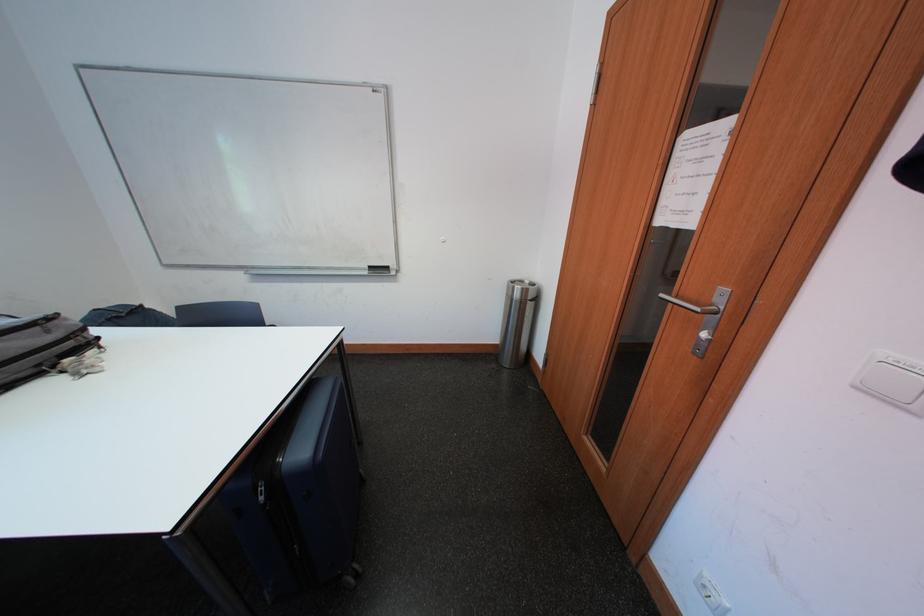
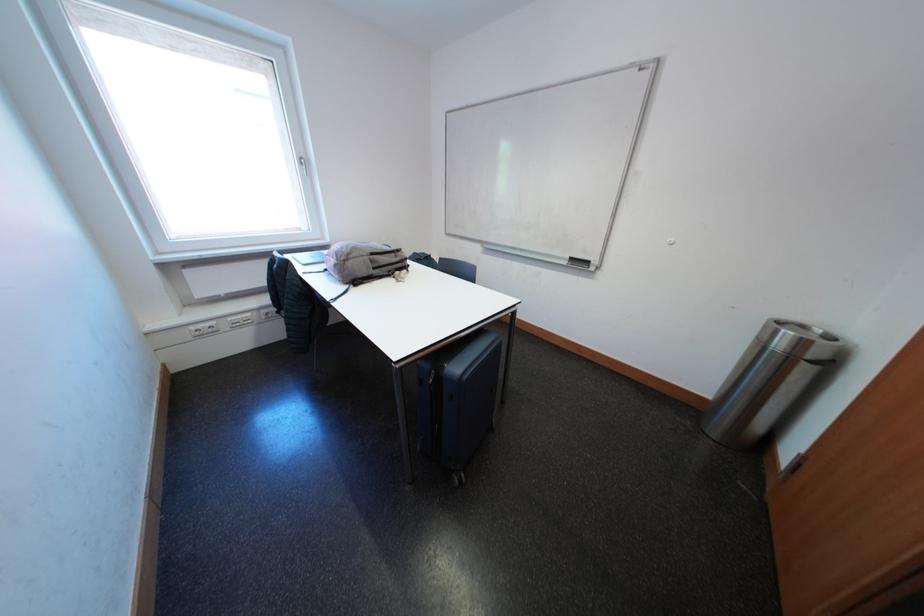
Question: The first image is from the beginning of the video and the second image is from the end. How did the camera likely rotate when shooting the video?

Choices:
 (A) Left
 (B) Right
 (C) Up
 (D) Down

Answer: (A)